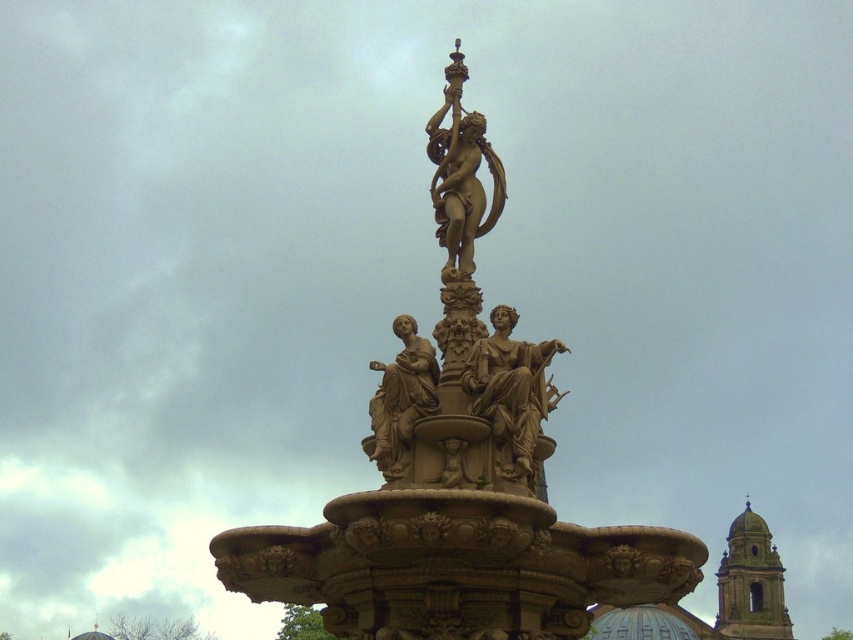
Question: Which object is closer to the camera taking this photo?

Choices:
 (A) matte bronze statue at center
 (B) brown stone fountain at center
 (C) gold polished statue at center

Answer: (B)

Question: Estimate the real-world distances between objects in this image. Which object is closer to the matte bronze statue at center?

Choices:
 (A) bronze statue at center
 (B) brown stone fountain at center
 (C) gold polished statue at center

Answer: (A)

Question: Does bronze statue at center appear under matte bronze statue at center?

Choices:
 (A) no
 (B) yes

Answer: (B)

Question: Which of the following is the closest to the observer?

Choices:
 (A) (399, 465)
 (B) (534, 417)
 (C) (448, 166)

Answer: (A)

Question: Is brown stone fountain at center positioned behind matte bronze statue at center?

Choices:
 (A) yes
 (B) no

Answer: (B)

Question: Does bronze statue at center have a larger size compared to gold polished statue at center?

Choices:
 (A) yes
 (B) no

Answer: (B)